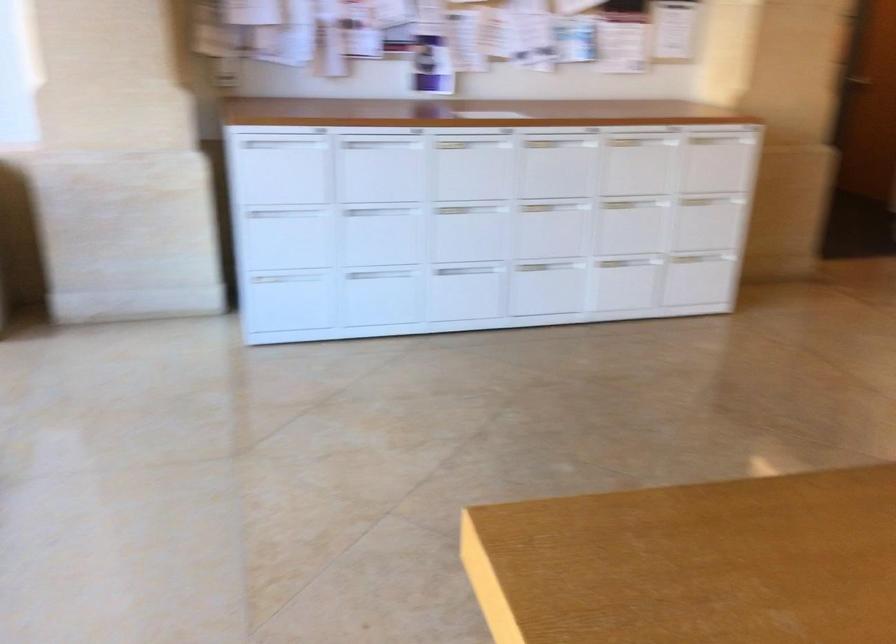
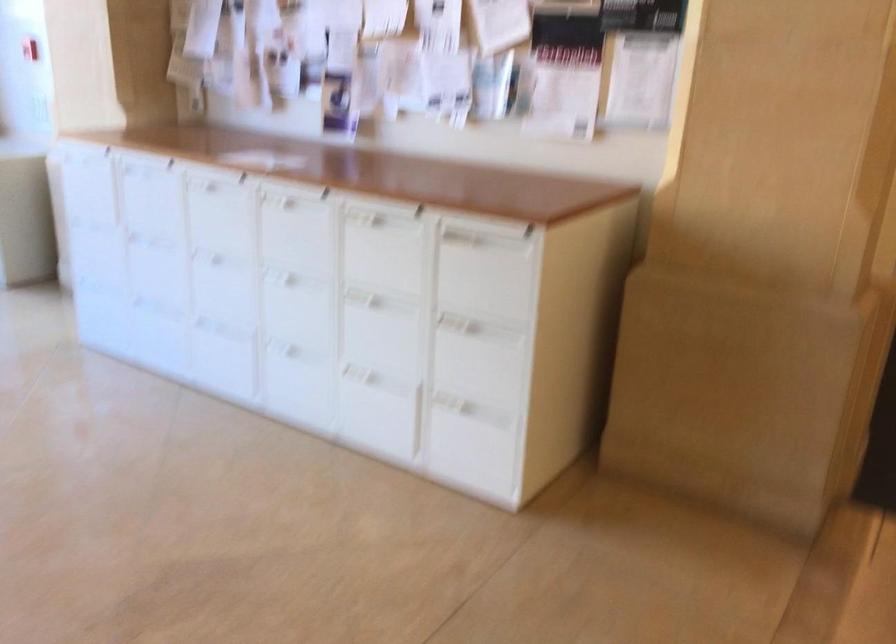
Where in the second image is the point corresponding to [467,164] from the first image?

(220, 214)